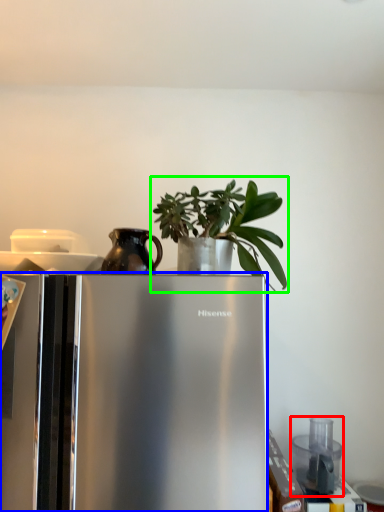
Question: Which is farther away from appliance (highlighted by a red box)? refrigerator (highlighted by a blue box) or houseplant (highlighted by a green box)?

Choices:
 (A) refrigerator
 (B) houseplant

Answer: (A)